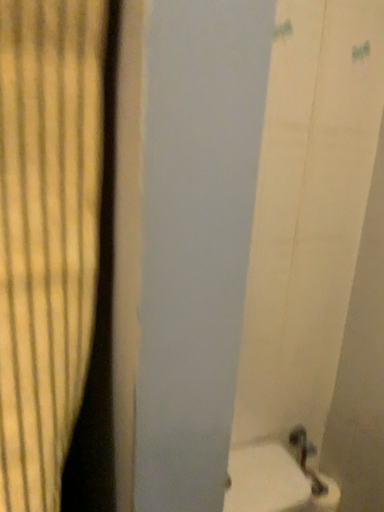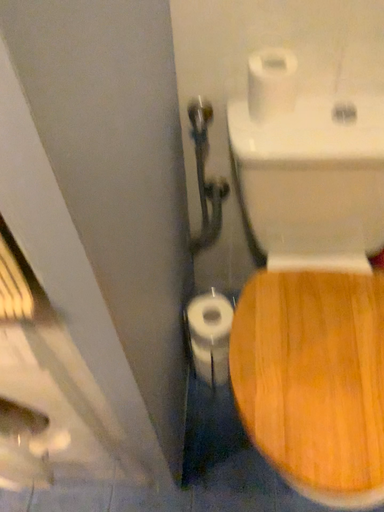
Question: How did the camera likely rotate when shooting the video?

Choices:
 (A) rotated right
 (B) rotated left

Answer: (B)